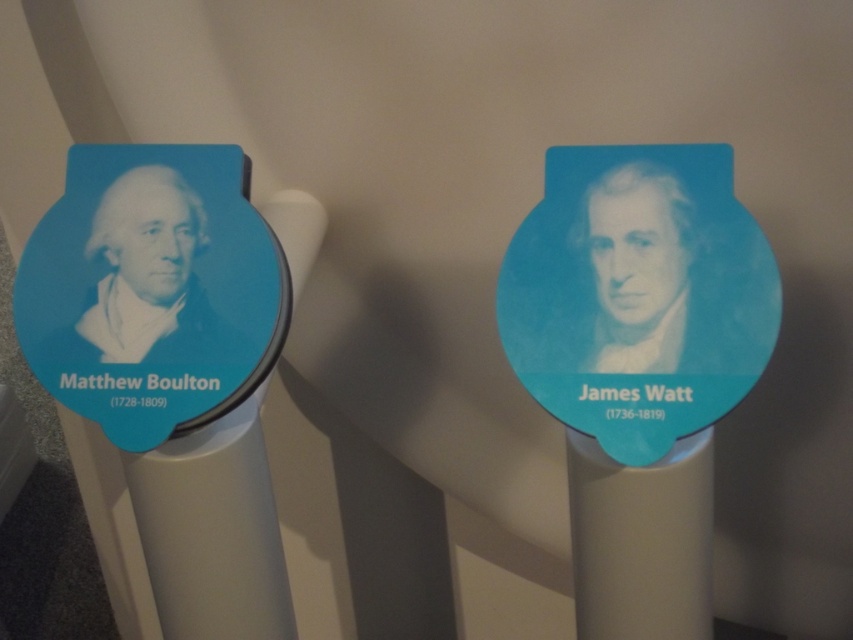
Question: Does matte plastic pillar at center lie behind blue glossy portrait at center?

Choices:
 (A) yes
 (B) no

Answer: (B)

Question: Can you confirm if matte plastic pillar at center is wider than blue matte portrait at left?

Choices:
 (A) yes
 (B) no

Answer: (A)

Question: Which point is closer to the camera?

Choices:
 (A) blue matte portrait at left
 (B) blue matte sticker at left

Answer: (B)

Question: Which point appears closest to the camera in this image?

Choices:
 (A) coord(592,600)
 (B) coord(80,237)
 (C) coord(165,356)
 (D) coord(598,276)

Answer: (D)

Question: Which of the following is the closest to the observer?

Choices:
 (A) (169, 376)
 (B) (602, 316)

Answer: (B)

Question: Is blue glossy portrait at center positioned before blue matte portrait at left?

Choices:
 (A) yes
 (B) no

Answer: (A)